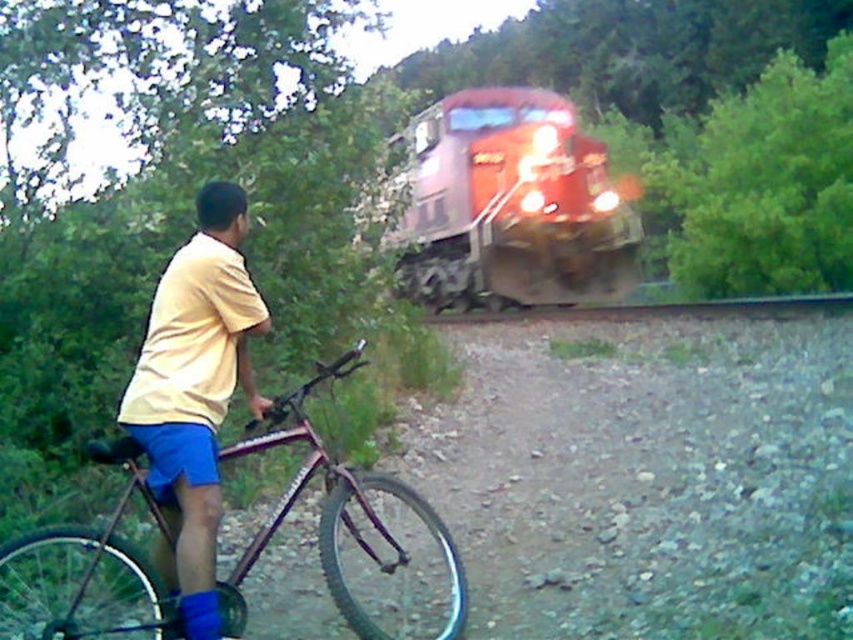
Which is behind, point (171, 384) or point (451, 540)?

Point (451, 540)

Does yellow matte shirt at left have a smaller size compared to metallic purple mountain bike at left?

Yes, yellow matte shirt at left is smaller than metallic purple mountain bike at left.

Locate an element on the screen. yellow matte shirt at left is located at coordinates (195, 392).

Is point (453, 189) more distant than point (97, 632)?

That is True.

Is red glossy train at center to the left of metallic purple mountain bike at left from the viewer's perspective?

In fact, red glossy train at center is to the right of metallic purple mountain bike at left.

The height and width of the screenshot is (640, 853). In order to click on red glossy train at center in this screenshot , I will do `click(509, 205)`.

From the picture: How much distance is there between red glossy train at center and yellow matte shirt at left?

A distance of 7.59 meters exists between red glossy train at center and yellow matte shirt at left.

The width and height of the screenshot is (853, 640). What do you see at coordinates (509, 205) in the screenshot? I see `red glossy train at center` at bounding box center [509, 205].

Image resolution: width=853 pixels, height=640 pixels. What do you see at coordinates (509, 205) in the screenshot?
I see `red glossy train at center` at bounding box center [509, 205].

The width and height of the screenshot is (853, 640). I want to click on red glossy train at center, so click(509, 205).